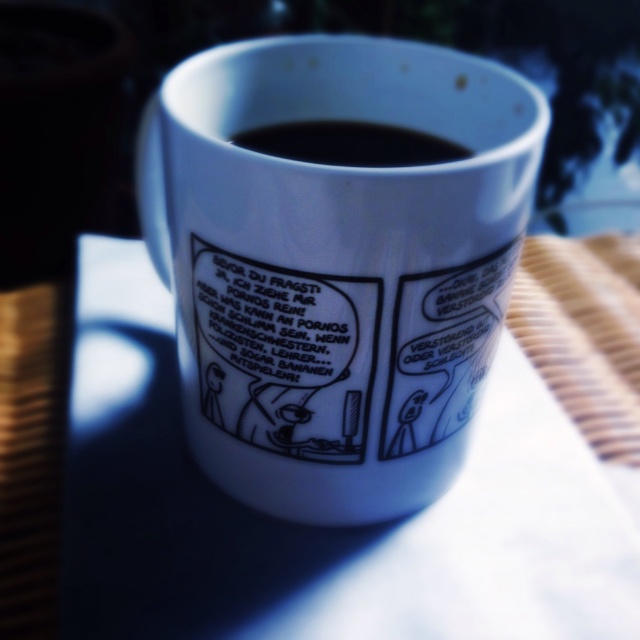
Question: Which object appears closest to the camera in this image?

Choices:
 (A) white glossy mug at center
 (B) black glossy coffee at upper center

Answer: (A)

Question: From the image, what is the correct spatial relationship of white glossy mug at center in relation to white fabric at upper center?

Choices:
 (A) below
 (B) above

Answer: (B)

Question: Does white glossy mug at center come behind white fabric at upper center?

Choices:
 (A) no
 (B) yes

Answer: (A)

Question: Does white fabric at upper center lie behind black glossy coffee at upper center?

Choices:
 (A) no
 (B) yes

Answer: (A)

Question: Estimate the real-world distances between objects in this image. Which object is closer to the white fabric at upper center?

Choices:
 (A) white glossy mug at center
 (B) black glossy coffee at upper center

Answer: (A)

Question: Which object is the farthest from the white glossy mug at center?

Choices:
 (A) white fabric at upper center
 (B) black glossy coffee at upper center

Answer: (A)